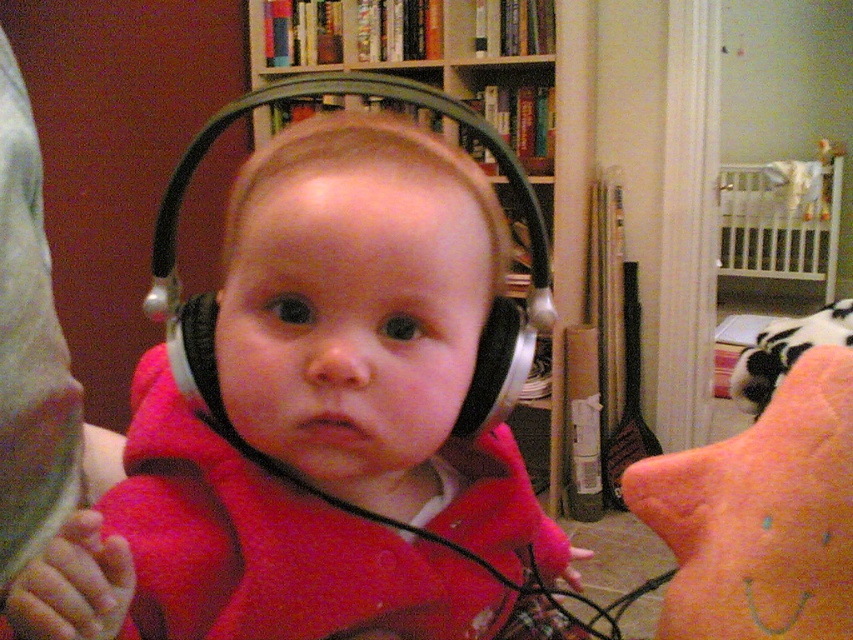
You are a parent trying to decide whether to place the matte black headphones at center on top of the wooden bookshelf at upper center. Considering their sizes, will the headphones fit without overhanging the edge?

The matte black headphones at center has a smaller size compared to wooden bookshelf at upper center, so they will fit without overhanging the edge.

You are a photographer trying to capture the baby wearing the matte black headphones at center. You want to ensure the baby stays in the frame while adjusting your camera settings. Given the baby is currently at point (374, 330), which is the location of the headphones, where should you position your camera to keep the baby centered?

The matte black headphones at center are located at point (374, 330), so positioning the camera directly facing this coordinate will keep the baby centered in the frame.

You are a photographer setting up a studio. You have two points marked on your camera screen at coordinates point (154, 532) and point (497, 19). According to the image, which point is closer to the baby wearing the large over ear headphones?

Point (154, 532) is closer to the baby wearing the large over ear headphones because it is in front of point (497, 19).